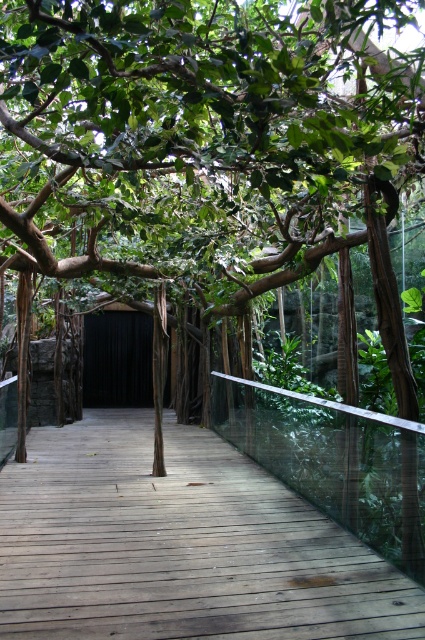
Question: Is green leafy tree at center below brown wooden path at center?

Choices:
 (A) no
 (B) yes

Answer: (A)

Question: Among these objects, which one is farthest from the camera?

Choices:
 (A) brown wooden path at center
 (B) green leafy tree at center

Answer: (A)

Question: Does green leafy tree at center come in front of brown wooden path at center?

Choices:
 (A) yes
 (B) no

Answer: (A)

Question: Which point is farther from the camera taking this photo?

Choices:
 (A) [64, 40]
 (B) [189, 456]

Answer: (B)

Question: Which point is closer to the camera?

Choices:
 (A) (56, 586)
 (B) (11, 22)

Answer: (B)

Question: Observing the image, what is the correct spatial positioning of green leafy tree at center in reference to brown wooden path at center?

Choices:
 (A) above
 (B) below

Answer: (A)